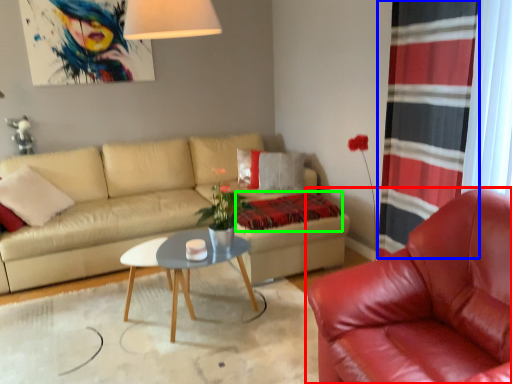
Question: Considering the real-world distances, which object is closest to chair (highlighted by a red box)? curtain (highlighted by a blue box) or blanket (highlighted by a green box).

Choices:
 (A) curtain
 (B) blanket

Answer: (A)